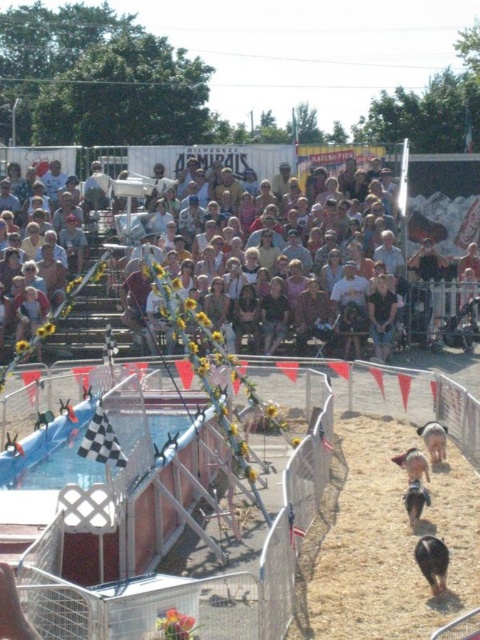
You are a photographer at the pig race event. You want to capture a photo that includes both the brown dirt track at lower right and the dark brown hair at center. Which object should you focus on first to ensure both are in frame?

The brown dirt track at lower right is wider than the dark brown hair at center, so you should focus on the brown dirt track at lower right first to ensure both fit in the frame.

You are a photographer at the pig race event and want to capture a photo of the black fuzzy pig at lower right running along the brown dirt track at lower right. Can you estimate if the pig will fit entirely within the width of the track?

The brown dirt track at lower right might be wider than black fuzzy pig at lower right, so there is a possibility that the pig will fit within the track width, but the exact dimensions are uncertain.